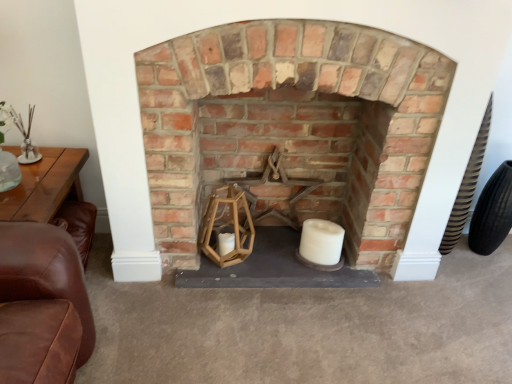
Question: From a real-world perspective, is rustic brick fireplace at center positioned above or below black rubber tire at right?

Choices:
 (A) below
 (B) above

Answer: (B)

Question: From the image's perspective, is rustic brick fireplace at center positioned above or below black rubber tire at right?

Choices:
 (A) above
 (B) below

Answer: (A)

Question: Considering the real-world distances, which object is closest to the rustic brick fireplace at center?

Choices:
 (A) black rubber tire at right
 (B) white matte candle at center

Answer: (B)

Question: Based on their relative distances, which object is nearer to the rustic brick fireplace at center?

Choices:
 (A) black rubber tire at right
 (B) white matte candle at center

Answer: (B)